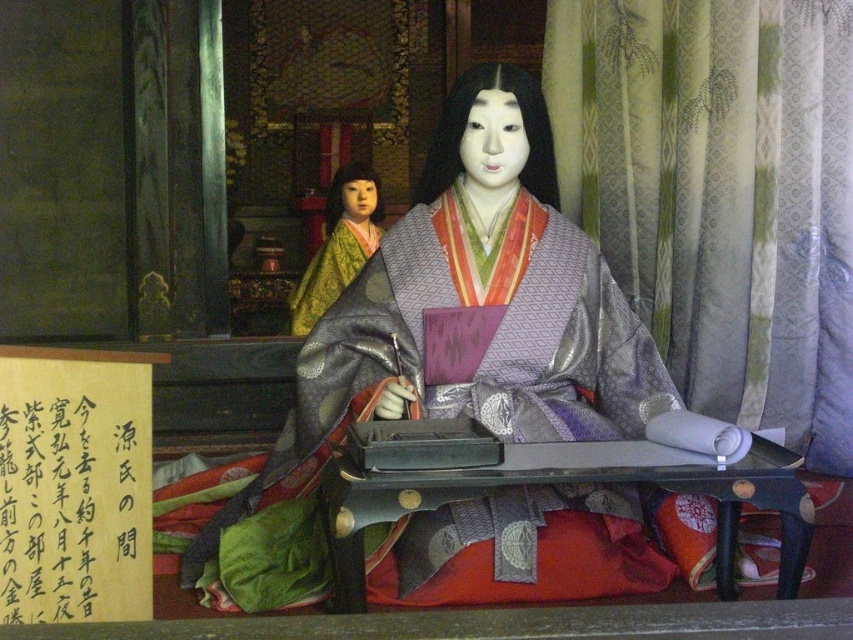
You are an observer in the scene. You notice the silky green curtain at right and the silky green kimono at left. Which object is positioned lower in the image?

The silky green curtain at right is located below the silky green kimono at left, so it is positioned lower in the image.

You are an interior designer planning to hang a new painting in this traditional Japanese scene. The painting must be placed above the silky purple kimono at center but below the silky green curtain at right. Is this possible given their positions?

The silky green curtain at right is much taller than the silky purple kimono at center, so placing a painting above the kimono but below the curtain is possible as there is vertical space between them.

You are standing in a museum and see the silky purple kimono at center. The museum requires that visitors maintain a minimum distance of 3 meters from all exhibits. Are you currently violating the museum rules?

The silky purple kimono at center is 2.81 meters from viewer, which is less than the required 3 meters. Therefore, you are violating the museum rules.